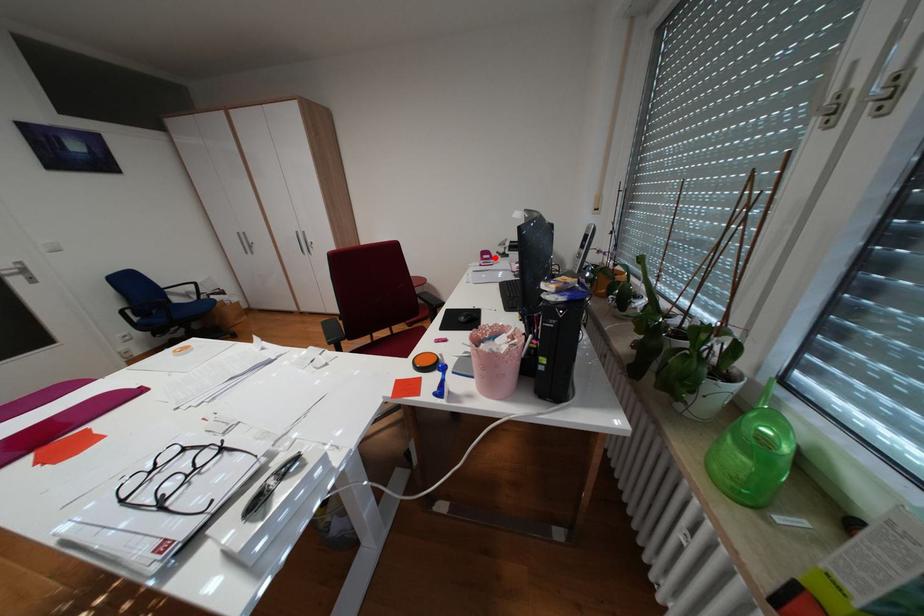
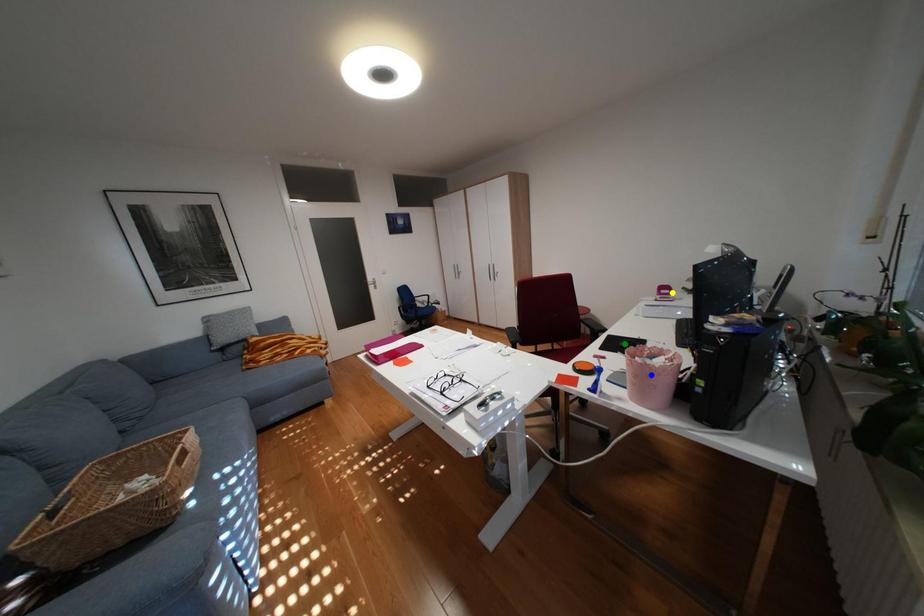
Question: I am providing you with two images of the same scene from different viewpoints. A red point is marked on the first image. You are given multiple points on the second image. Which spot in image 2 lines up with the point in image 1?

Choices:
 (A) yellow point
 (B) green point
 (C) blue point

Answer: (A)